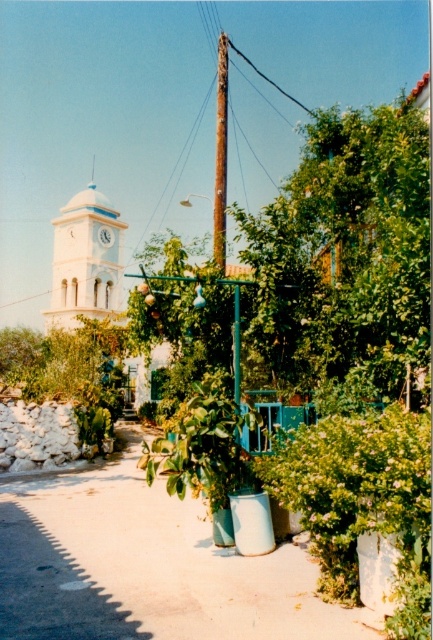
You are a tourist standing on the paved pathway and want to take a photo of both the green leafy tree at center and the matte white clock at center. Which object should you focus on first to ensure both are in clear view?

You should focus on the green leafy tree at center first since it is closer to you than the matte white clock at center, allowing both to be in focus when using a camera with depth of field.